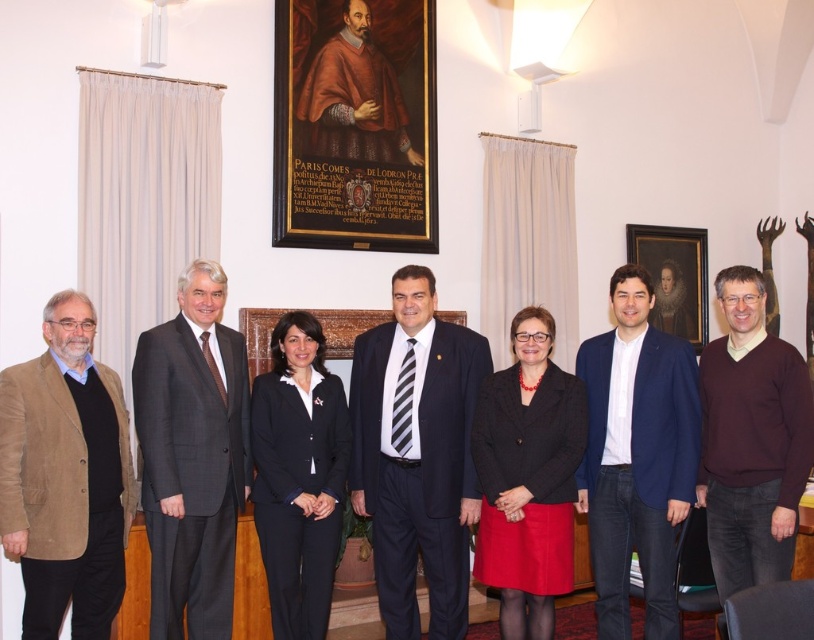
Question: Is matte black blazer at center bigger than navy blue suit at center?

Choices:
 (A) yes
 (B) no

Answer: (A)

Question: Estimate the real-world distances between objects in this image. Which object is closer to the dark gray suit at center?

Choices:
 (A) navy blue suit at center
 (B) dark blue suit at center
 (C) matte black blazer at center

Answer: (A)

Question: Can you confirm if brown suede blazer at left is positioned to the left of wooden portrait frame at center?

Choices:
 (A) no
 (B) yes

Answer: (B)

Question: Is dark blue suit at center thinner than navy blue suit at center?

Choices:
 (A) no
 (B) yes

Answer: (A)

Question: Considering the real-world distances, which object is farthest from the blue fabric jacket at center?

Choices:
 (A) brown suede blazer at left
 (B) dark blue suit at center
 (C) dark gray suit at center

Answer: (A)

Question: Which of these objects is positioned closest to the blue fabric jacket at center?

Choices:
 (A) dark gray suit at center
 (B) maroon sweater at center
 (C) navy blue suit at center

Answer: (B)